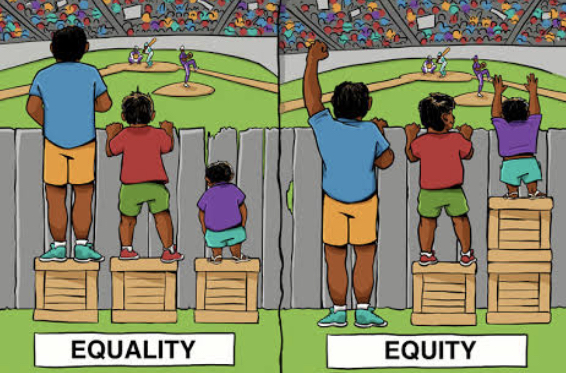
Locate an element on the screen. This screenshot has width=566, height=373. pitcher is located at coordinates (478, 69), (185, 59).